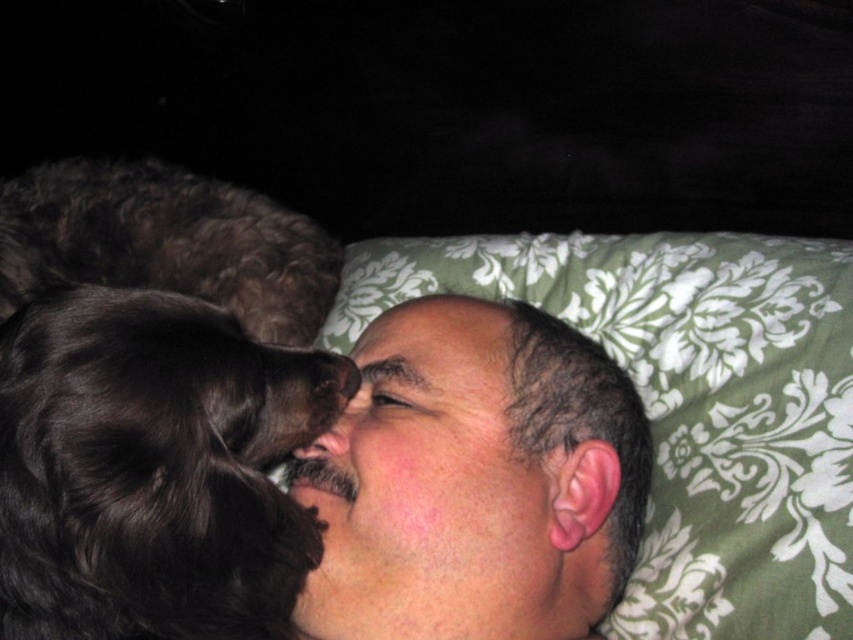
The width and height of the screenshot is (853, 640). Describe the element at coordinates (152, 468) in the screenshot. I see `black fluffy dog at left` at that location.

Is black fluffy dog at left further to the viewer compared to smooth skin face at center?

No, black fluffy dog at left is closer to the viewer.

What do you see at coordinates (152, 468) in the screenshot? I see `black fluffy dog at left` at bounding box center [152, 468].

At what (x,y) coordinates should I click in order to perform the action: click on black fluffy dog at left. Please return your answer as a coordinate pair (x, y). The width and height of the screenshot is (853, 640). Looking at the image, I should click on (152, 468).

Between smooth skin face at center and dark brown fur at left, which one appears on the left side from the viewer's perspective?

From the viewer's perspective, dark brown fur at left appears more on the left side.

Does smooth skin face at center have a lesser width compared to dark brown fur at left?

Indeed, smooth skin face at center has a lesser width compared to dark brown fur at left.

You are a GUI agent. You are given a task and a screenshot of the screen. Output one action in this format:
    pyautogui.click(x=<x>, y=<y>)
    Task: Click on the smooth skin face at center
    
    Given the screenshot: What is the action you would take?
    pyautogui.click(x=431, y=492)

This screenshot has height=640, width=853. What are the coordinates of `smooth skin face at center` in the screenshot? It's located at (431, 492).

Does green floral fabric at center have a larger size compared to brown fur nose at center?

Yes, green floral fabric at center is bigger than brown fur nose at center.

Identify the location of green floral fabric at center. (689, 404).

Between point (741, 547) and point (364, 394), which one is positioned behind?

Point (364, 394)

Where is `green floral fabric at center`? green floral fabric at center is located at coordinates (689, 404).